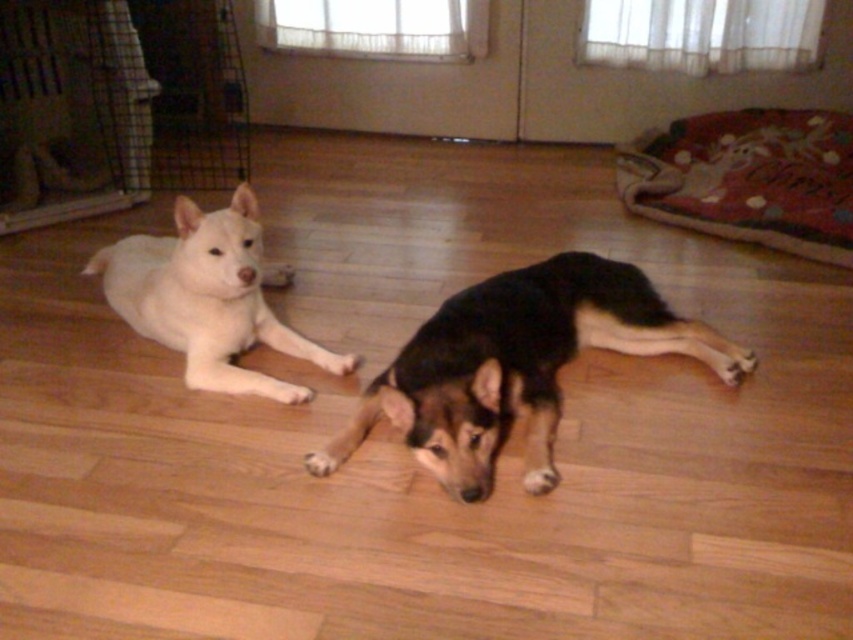
You are a dog owner who wants to buy a new dog bed. The bed is designed to accommodate taller dogs. Based on the scene, which dog would need a taller bed between the black fur dog at center and the white fur dog at left?

The black fur dog at center is much taller than the white fur dog at left, so it would need a taller bed.

You are standing in the room and want to pick up an object located at point (253, 260). However, there is an obstacle at point (740, 365) blocking your path. Can you reach the desired point without moving the obstacle?

Point (740, 365) is further to the camera than point (253, 260), so the obstacle at point (740, 365) is behind the desired point. Therefore, you can reach the desired point without moving the obstacle.